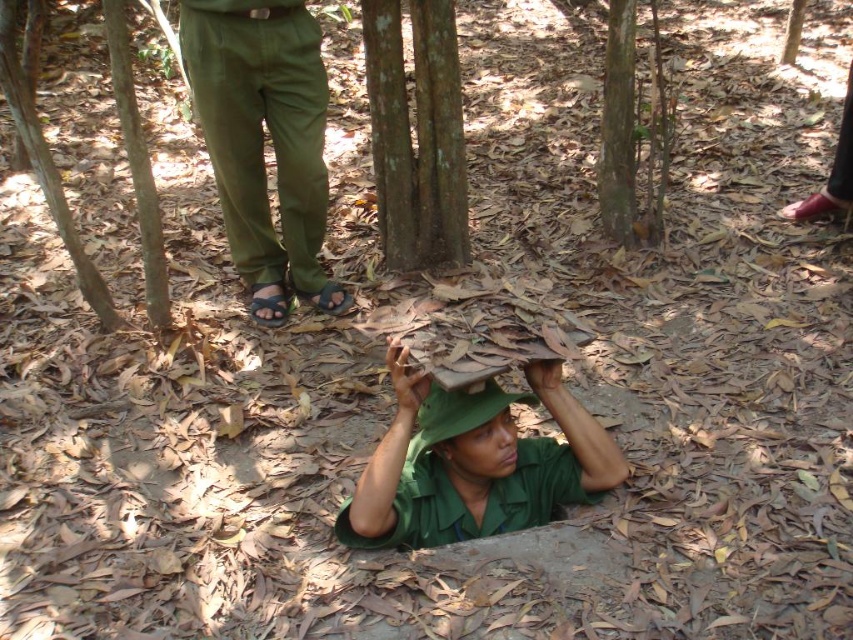
Question: Is black fabric sandal at lower center smaller than smooth brown tree trunk at center?

Choices:
 (A) yes
 (B) no

Answer: (A)

Question: Which object is the closest to the green matte uniform at center?

Choices:
 (A) brown rough tree trunk at center
 (B) smooth brown bark at center
 (C) brown rough tree at upper left

Answer: (A)

Question: Can you confirm if olive green pants at center is positioned above smooth brown bark at center?

Choices:
 (A) yes
 (B) no

Answer: (B)

Question: Based on their relative distances, which object is farther from the brown fabric sandal at lower center?

Choices:
 (A) green fabric hat at center
 (B) olive green pants at center

Answer: (A)

Question: Does brown rough tree trunk at center have a greater width compared to brown rough tree at upper left?

Choices:
 (A) yes
 (B) no

Answer: (B)

Question: Which point is farther to the camera?

Choices:
 (A) olive green pants at center
 (B) green fabric hat at center
 (C) smooth brown bark at center

Answer: (C)